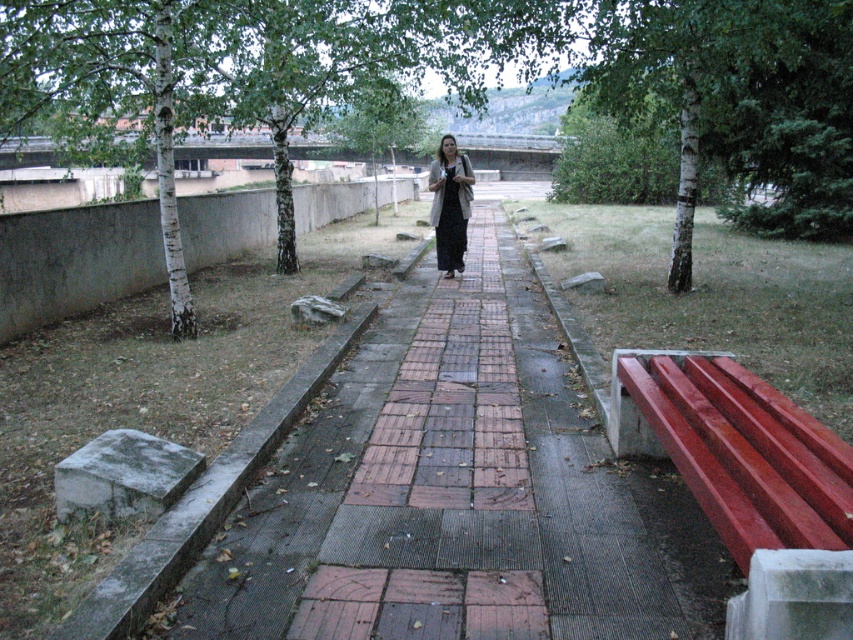
Question: Is brick paved walkway at center above smooth red bench at right?

Choices:
 (A) yes
 (B) no

Answer: (A)

Question: Which of these objects is positioned closest to the dark gray fabric dress at center?

Choices:
 (A) brick paved walkway at center
 (B) smooth red bench at right

Answer: (A)

Question: Which of the following is the farthest from the observer?

Choices:
 (A) dark gray fabric dress at center
 (B) smooth red bench at right

Answer: (A)

Question: Can you confirm if brick paved walkway at center is positioned above smooth red bench at right?

Choices:
 (A) yes
 (B) no

Answer: (A)

Question: Among these objects, which one is farthest from the camera?

Choices:
 (A) smooth red bench at right
 (B) dark gray fabric dress at center

Answer: (B)

Question: Is the position of brick paved walkway at center more distant than that of smooth red bench at right?

Choices:
 (A) no
 (B) yes

Answer: (B)